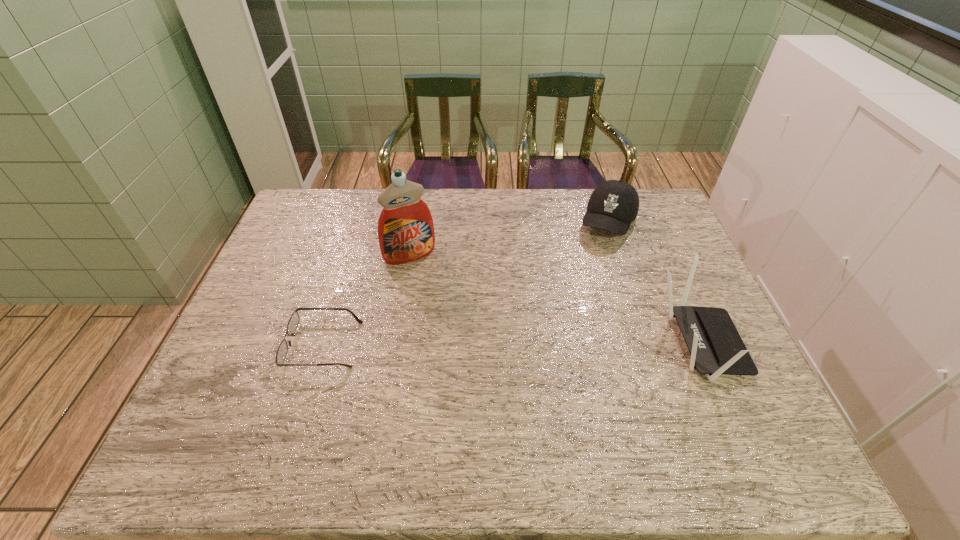
You are a GUI agent. You are given a task and a screenshot of the screen. Output one action in this format:
    pyautogui.click(x=<x>, y=<y>)
    Task: Click on the free space on the desktop that is between the spectacles and the second tallest object and is positioned on the front-facing side of the baseball cap
    This screenshot has width=960, height=540.
    Given the screenshot: What is the action you would take?
    pyautogui.click(x=552, y=344)

Find the location of `vacant spot on the desktop that is between the spectacles and the third shortest object and is positioned on the front surface of the detergent`. vacant spot on the desktop that is between the spectacles and the third shortest object and is positioned on the front surface of the detergent is located at coordinates (461, 345).